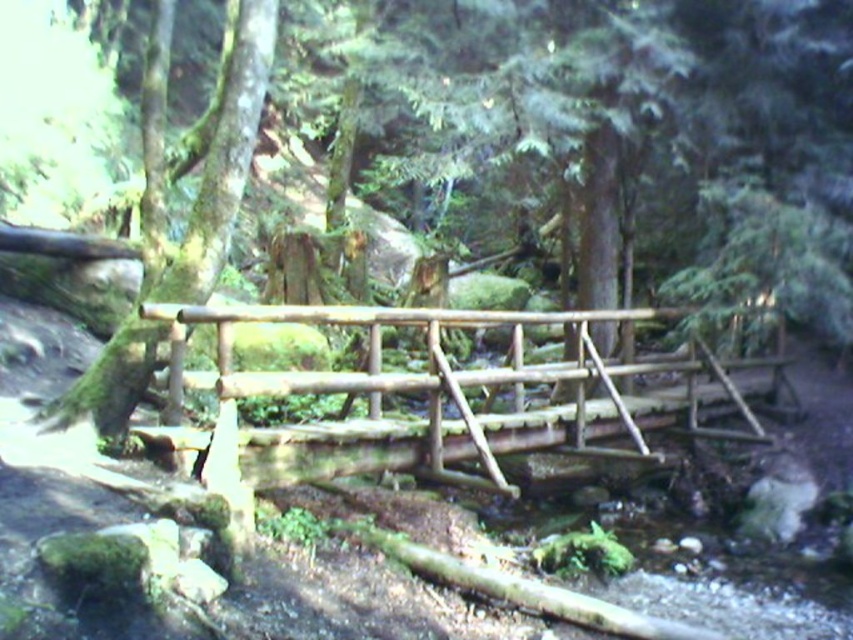
You are a hiker carrying a backpack weighing 20 pounds. You need to cross the natural wood bridge at center. Before you start, you notice the green mossy tree at left nearby. Considering the distance between them, do you think the tree is close enough to offer shade while you rest after crossing the bridge?

The distance between the natural wood bridge at center and the green mossy tree at left is 5.74 feet. Since the tree is only about 5.74 feet away from the bridge, it is close enough to provide shade for resting after crossing.

Looking at this image, you are a hiker trying to cross the stream. The natural wood bridge at center is your only path. If you have a backpack that is 2 meters wide, can you safely cross the bridge without touching the green mossy tree at left?

The natural wood bridge at center is wider than the green mossy tree at left. Since the bridge is wider, it should provide enough space for your 2m wide backpack to cross safely without touching the tree.